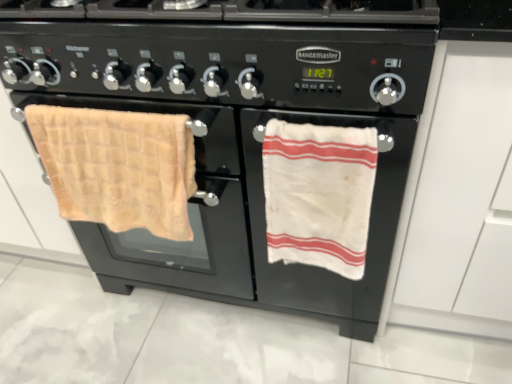
The image size is (512, 384). I want to click on white cotton towel at right, which is the 1th beach towel from right to left, so pos(319,194).

Measure the distance between black matte gas stove at center and camera.

The distance of black matte gas stove at center from camera is 25.96 inches.

Identify the location of white matte drawer at right. (460, 198).

Locate an element on the screen. This screenshot has height=384, width=512. white cotton towel at right, which ranks as the 2th beach towel in left-to-right order is located at coordinates (319, 194).

From a real-world perspective, between white matte drawer at right and black matte gas stove at center, who is vertically lower?

white matte drawer at right, from a real-world perspective.

Is white matte drawer at right bigger or smaller than black matte gas stove at center?

In the image, white matte drawer at right appears to be larger than black matte gas stove at center.

Is the position of white matte drawer at right less distant than that of black matte gas stove at center?

Yes, it is in front of black matte gas stove at center.

Would you say black matte gas stove at center is part of white matte drawer at right's contents?

No.

Could you tell me if white cotton towel at right, which ranks as the 2th beach towel in left-to-right order, is turned towards beige waffle weave towel at left, positioned as the 2th beach towel in right-to-left order?

No, white cotton towel at right, which ranks as the 2th beach towel in left-to-right order, is not oriented towards beige waffle weave towel at left, positioned as the 2th beach towel in right-to-left order.

From the image's perspective, is white cotton towel at right, which is the 1th beach towel from right to left, located above or below beige waffle weave towel at left, marked as the 1th beach towel in a left-to-right arrangement?

Clearly, from the image's perspective, white cotton towel at right, which is the 1th beach towel from right to left, is below beige waffle weave towel at left, marked as the 1th beach towel in a left-to-right arrangement.

Which is in front, point (279, 255) or point (62, 164)?

The point (279, 255) is more forward.

Is white cotton towel at right, which is the 1th beach towel from right to left, inside the boundaries of beige waffle weave towel at left, positioned as the 2th beach towel in right-to-left order, or outside?

The correct answer is: outside.

How far apart are black matte gas stove at center and white cotton towel at right, which ranks as the 2th beach towel in left-to-right order?

black matte gas stove at center and white cotton towel at right, which ranks as the 2th beach towel in left-to-right order, are 21.40 centimeters apart.

Which is in front, point (242, 41) or point (302, 187)?

The point (242, 41) is more forward.

Can you tell me how much black matte gas stove at center and white cotton towel at right, which is the 1th beach towel from right to left, differ in facing direction?

0.00126 degrees.

Between black matte gas stove at center and white cotton towel at right, which is the 1th beach towel from right to left, which one appears on the right side from the viewer's perspective?

From the viewer's perspective, white cotton towel at right, which is the 1th beach towel from right to left, appears more on the right side.

Between white matte drawer at right and beige waffle weave towel at left, positioned as the 2th beach towel in right-to-left order, which one has more height?

white matte drawer at right.

Considering the points (457, 282) and (178, 186), which point is in front, point (457, 282) or point (178, 186)?

Point (178, 186)

Find the location of a particular element. The width and height of the screenshot is (512, 384). drawer above the beige waffle weave towel at left, marked as the 1th beach towel in a left-to-right arrangement (from the image's perspective) is located at coordinates (x=460, y=198).

Is white matte drawer at right oriented towards beige waffle weave towel at left, marked as the 1th beach towel in a left-to-right arrangement?

No, white matte drawer at right is not oriented towards beige waffle weave towel at left, marked as the 1th beach towel in a left-to-right arrangement.

Is white cotton towel at right, which is the 1th beach towel from right to left, next to white matte drawer at right?

No.

This screenshot has height=384, width=512. What are the coordinates of `drawer below the white cotton towel at right, which ranks as the 2th beach towel in left-to-right order (from a real-world perspective)` in the screenshot? It's located at (460, 198).

Which object is more forward, white cotton towel at right, which is the 1th beach towel from right to left, or white matte drawer at right?

Positioned in front is white matte drawer at right.

Is the depth of black matte gas stove at center greater than that of beige waffle weave towel at left, positioned as the 2th beach towel in right-to-left order?

No, it is not.

Considering the positions of objects black matte gas stove at center and beige waffle weave towel at left, positioned as the 2th beach towel in right-to-left order, in the image provided, who is more to the right, black matte gas stove at center or beige waffle weave towel at left, positioned as the 2th beach towel in right-to-left order,?

From the viewer's perspective, black matte gas stove at center appears more on the right side.

Between black matte gas stove at center and beige waffle weave towel at left, marked as the 1th beach towel in a left-to-right arrangement, which one has larger size?

Bigger between the two is black matte gas stove at center.

Is black matte gas stove at center oriented away from beige waffle weave towel at left, positioned as the 2th beach towel in right-to-left order?

No, beige waffle weave towel at left, positioned as the 2th beach towel in right-to-left order, is not at the back of black matte gas stove at center.

From the image's perspective, is beige waffle weave towel at left, positioned as the 2th beach towel in right-to-left order, above or below black matte gas stove at center?

Based on their image positions, beige waffle weave towel at left, positioned as the 2th beach towel in right-to-left order, is located beneath black matte gas stove at center.

Is beige waffle weave towel at left, marked as the 1th beach towel in a left-to-right arrangement, wider or thinner than black matte gas stove at center?

beige waffle weave towel at left, marked as the 1th beach towel in a left-to-right arrangement, is thinner than black matte gas stove at center.

Is black matte gas stove at center at the back of beige waffle weave towel at left, positioned as the 2th beach towel in right-to-left order?

That's right, beige waffle weave towel at left, positioned as the 2th beach towel in right-to-left order, is facing away from black matte gas stove at center.

In the image, is beige waffle weave towel at left, marked as the 1th beach towel in a left-to-right arrangement, positioned in front of or behind black matte gas stove at center?

beige waffle weave towel at left, marked as the 1th beach towel in a left-to-right arrangement, is positioned farther from the viewer than black matte gas stove at center.

You are a GUI agent. You are given a task and a screenshot of the screen. Output one action in this format:
    pyautogui.click(x=<x>, y=<y>)
    Task: Click on the gas stove above the white matte drawer at right (from the image's perspective)
    
    Given the screenshot: What is the action you would take?
    pyautogui.click(x=227, y=51)

I want to click on beach towel in front of the beige waffle weave towel at left, positioned as the 2th beach towel in right-to-left order, so click(x=319, y=194).

Estimate the real-world distances between objects in this image. Which object is further from white cotton towel at right, which ranks as the 2th beach towel in left-to-right order, black matte gas stove at center or white matte drawer at right?

white matte drawer at right is positioned further to the anchor white cotton towel at right, which ranks as the 2th beach towel in left-to-right order.

Considering their positions, is beige waffle weave towel at left, marked as the 1th beach towel in a left-to-right arrangement, positioned closer to white cotton towel at right, which ranks as the 2th beach towel in left-to-right order, than black matte gas stove at center?

black matte gas stove at center lies closer to white cotton towel at right, which ranks as the 2th beach towel in left-to-right order, than the other object.

When comparing their distances from black matte gas stove at center, does beige waffle weave towel at left, marked as the 1th beach towel in a left-to-right arrangement, or white matte drawer at right seem closer?

beige waffle weave towel at left, marked as the 1th beach towel in a left-to-right arrangement, lies closer to black matte gas stove at center than the other object.

Estimate the real-world distances between objects in this image. Which object is further from white matte drawer at right, beige waffle weave towel at left, marked as the 1th beach towel in a left-to-right arrangement, or white cotton towel at right, which ranks as the 2th beach towel in left-to-right order?

Based on the image, beige waffle weave towel at left, marked as the 1th beach towel in a left-to-right arrangement, appears to be further to white matte drawer at right.

Based on the photo, from the image, which object appears to be nearer to white cotton towel at right, which ranks as the 2th beach towel in left-to-right order, black matte gas stove at center or beige waffle weave towel at left, positioned as the 2th beach towel in right-to-left order?

Based on the image, black matte gas stove at center appears to be nearer to white cotton towel at right, which ranks as the 2th beach towel in left-to-right order.

Considering their positions, is white matte drawer at right positioned closer to white cotton towel at right, which is the 1th beach towel from right to left, than beige waffle weave towel at left, positioned as the 2th beach towel in right-to-left order?

The object closer to white cotton towel at right, which is the 1th beach towel from right to left, is white matte drawer at right.

In the scene shown: When comparing their distances from black matte gas stove at center, does beige waffle weave towel at left, positioned as the 2th beach towel in right-to-left order, or white cotton towel at right, which ranks as the 2th beach towel in left-to-right order, seem closer?

beige waffle weave towel at left, positioned as the 2th beach towel in right-to-left order, lies closer to black matte gas stove at center than the other object.

Estimate the real-world distances between objects in this image. Which object is further from beige waffle weave towel at left, marked as the 1th beach towel in a left-to-right arrangement, white matte drawer at right or white cotton towel at right, which is the 1th beach towel from right to left?

white matte drawer at right.

This screenshot has height=384, width=512. What are the coordinates of `beach towel between black matte gas stove at center and white cotton towel at right, which ranks as the 2th beach towel in left-to-right order, vertically` in the screenshot? It's located at [118, 167].

Where is `gas stove between beige waffle weave towel at left, marked as the 1th beach towel in a left-to-right arrangement, and white matte drawer at right, in the horizontal direction`? gas stove between beige waffle weave towel at left, marked as the 1th beach towel in a left-to-right arrangement, and white matte drawer at right, in the horizontal direction is located at coordinates (227, 51).

Where is `beach towel situated between black matte gas stove at center and white matte drawer at right from left to right`? This screenshot has height=384, width=512. beach towel situated between black matte gas stove at center and white matte drawer at right from left to right is located at coordinates (319, 194).

Locate an element on the screen. The image size is (512, 384). beach towel between beige waffle weave towel at left, positioned as the 2th beach towel in right-to-left order, and white matte drawer at right, in the horizontal direction is located at coordinates (319, 194).